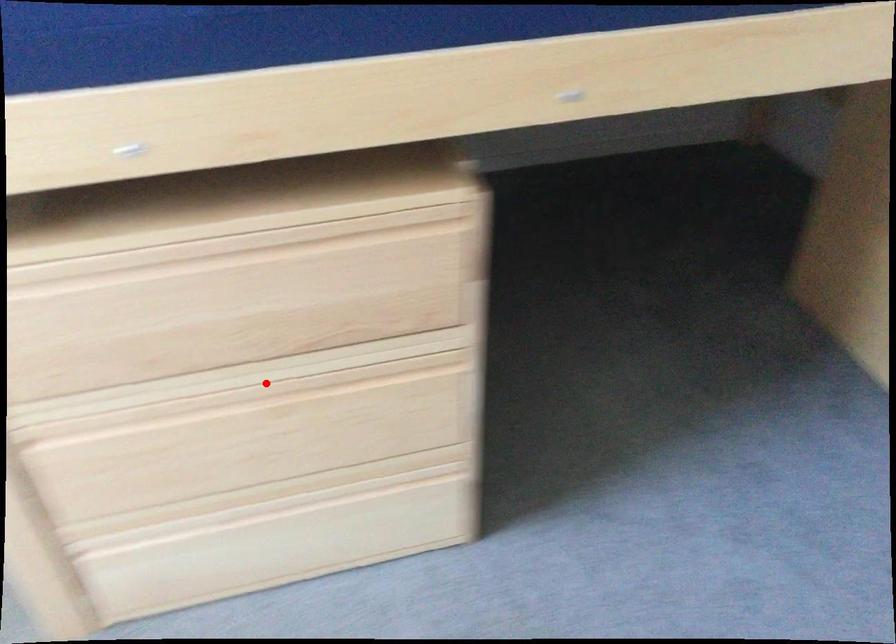
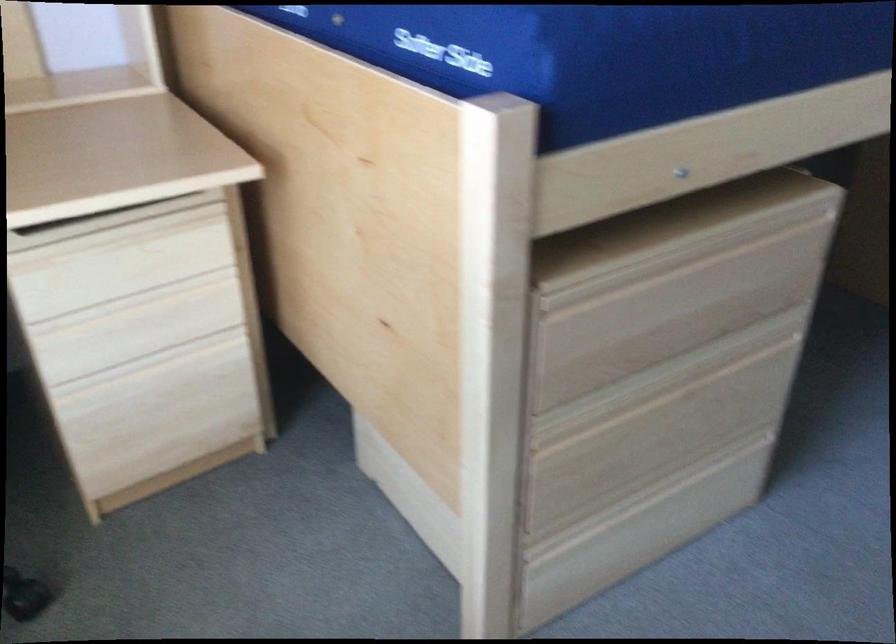
Question: I am providing you with two images of the same scene from different viewpoints. A red point is shown in image1. For the corresponding object point in image2, is it positioned nearer or farther from the camera?

Choices:
 (A) Nearer
 (B) Farther

Answer: (B)